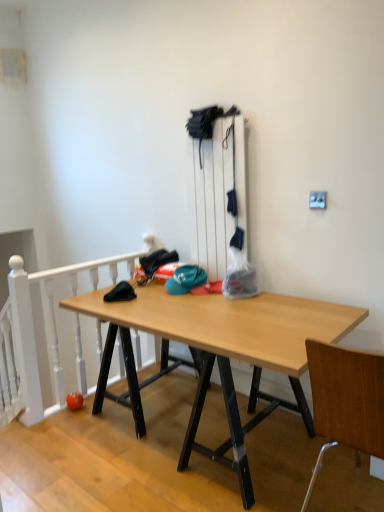
At what (x,y) coordinates should I click in order to perform the action: click on vacant location below wooden at right (from a real-world perspective). Please return your answer as a coordinate pair (x, y). The height and width of the screenshot is (512, 384). Looking at the image, I should click on (347, 496).